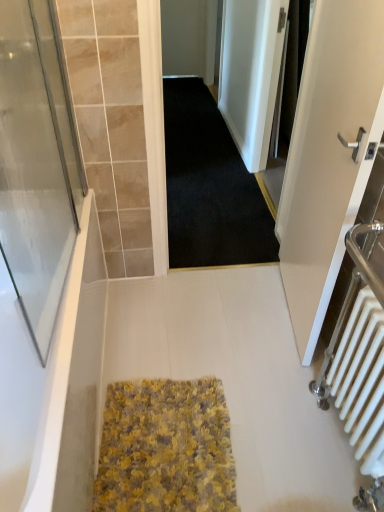
What is the approximate width of white metallic radiator at right?

It is 9.98 inches.

I want to click on black fabric screen door at upper right, marked as the first screen door in a right-to-left arrangement, so click(x=287, y=101).

In order to face transparent glass screen door at left, positioned as the second screen door in top-to-bottom order, should I rotate leftwards or rightwards?

Turn left approximately 19.048 degrees to face it.

Measure the distance between point (2, 205) and camera.

The depth of point (2, 205) is 6.33 feet.

Find the location of a particular element. Image resolution: width=384 pixels, height=512 pixels. black carpet at center is located at coordinates (210, 186).

From a real-world perspective, is white matte door at right below black carpet at center?

No, from a real-world perspective, white matte door at right is not below black carpet at center.

Considering the positions of objects white matte door at right and black carpet at center in the image provided, who is more to the right, white matte door at right or black carpet at center?

From the viewer's perspective, white matte door at right appears more on the right side.

Consider the image. Are white matte door at right and black carpet at center beside each other?

No, white matte door at right is not beside black carpet at center.

Considering the sizes of objects white matte door at right and black fabric screen door at upper right, the second screen door positioned from the bottom, in the image provided, who is bigger, white matte door at right or black fabric screen door at upper right, the second screen door positioned from the bottom,?

white matte door at right.

Is white matte door at right facing towards black fabric screen door at upper right, which ranks as the 2th screen door in front-to-back order?

No.

Is white matte door at right far from black fabric screen door at upper right, the first screen door in the back-to-front sequence?

Yes.

Between white matte door at right and black fabric screen door at upper right, the first screen door in the back-to-front sequence, which one has less height?

black fabric screen door at upper right, the first screen door in the back-to-front sequence.

Which is behind, point (219, 468) or point (45, 463)?

Positioned behind is point (219, 468).

Does yellow textured rug at center have a lesser width compared to white glossy bathtub at lower left?

Yes.

Is yellow textured rug at center in front of white glossy bathtub at lower left?

No, yellow textured rug at center is behind white glossy bathtub at lower left.

Is yellow textured rug at center oriented towards white glossy bathtub at lower left?

No, yellow textured rug at center is not oriented towards white glossy bathtub at lower left.

Is white glossy bathtub at lower left inside the boundaries of transparent glass screen door at left, the second screen door positioned from the back, or outside?

white glossy bathtub at lower left is spatially situated outside transparent glass screen door at left, the second screen door positioned from the back.

Which object is closer to the camera taking this photo, white glossy bathtub at lower left or transparent glass screen door at left, the second screen door positioned from the back?

transparent glass screen door at left, the second screen door positioned from the back, is closer to the camera.

Considering the relative positions of white glossy bathtub at lower left and transparent glass screen door at left, placed as the first screen door when sorted from left to right, in the image provided, is white glossy bathtub at lower left to the right of transparent glass screen door at left, placed as the first screen door when sorted from left to right, from the viewer's perspective?

In fact, white glossy bathtub at lower left is to the left of transparent glass screen door at left, placed as the first screen door when sorted from left to right.

From the image's perspective, which is above, white glossy bathtub at lower left or transparent glass screen door at left, positioned as the second screen door in top-to-bottom order?

transparent glass screen door at left, positioned as the second screen door in top-to-bottom order, appears higher in the image.

How many degrees apart are the facing directions of white metallic radiator at right and white matte door at right?

4.61 degrees separate the facing orientations of white metallic radiator at right and white matte door at right.

Between white metallic radiator at right and white matte door at right, which one is positioned behind?

white matte door at right is behind.

Between white metallic radiator at right and white matte door at right, which one has larger size?

Bigger between the two is white matte door at right.

This screenshot has width=384, height=512. Find the location of `bathtub to the left of black carpet at center`. bathtub to the left of black carpet at center is located at coordinates (53, 387).

Which is behind, point (25, 437) or point (188, 84)?

Positioned behind is point (188, 84).

Is white glossy bathtub at lower left not near black carpet at center?

That's right, there is a large distance between white glossy bathtub at lower left and black carpet at center.

From the image's perspective, is white glossy bathtub at lower left positioned above or below black carpet at center?

white glossy bathtub at lower left is situated lower than black carpet at center in the image.

Between black fabric screen door at upper right, marked as the first screen door in a right-to-left arrangement, and white matte door at right, which one is positioned behind?

black fabric screen door at upper right, marked as the first screen door in a right-to-left arrangement, is more distant.

Is black fabric screen door at upper right, the first screen door in the back-to-front sequence, positioned with its back to white matte door at right?

black fabric screen door at upper right, the first screen door in the back-to-front sequence, does not have its back to white matte door at right.

What are the coordinates of `screen door lying behind the white matte door at right` in the screenshot? It's located at (287, 101).

Where is `door in front of the black carpet at center`? The height and width of the screenshot is (512, 384). door in front of the black carpet at center is located at coordinates (329, 156).

Where is `the 2nd screen door positioned above the white matte door at right (from the image's perspective)`? This screenshot has width=384, height=512. the 2nd screen door positioned above the white matte door at right (from the image's perspective) is located at coordinates (287, 101).

Which object lies further to the anchor point yellow textured rug at center, transparent glass screen door at left, the second screen door when ordered from right to left, or white glossy bathtub at lower left?

The object further to yellow textured rug at center is transparent glass screen door at left, the second screen door when ordered from right to left.

Looking at the image, which one is located closer to transparent glass screen door at left, the 1th screen door positioned from the bottom, white matte door at right or white glossy bathtub at lower left?

Based on the image, white glossy bathtub at lower left appears to be nearer to transparent glass screen door at left, the 1th screen door positioned from the bottom.

Looking at the image, which one is located further to transparent glass screen door at left, the second screen door when ordered from right to left, white glossy bathtub at lower left or white matte door at right?

white matte door at right.

Which object lies further to the anchor point white glossy bathtub at lower left, black carpet at center or white matte door at right?

black carpet at center is further to white glossy bathtub at lower left.

When comparing their distances from white matte door at right, does yellow textured rug at center or white metallic radiator at right seem closer?

The object closer to white matte door at right is white metallic radiator at right.

Estimate the real-world distances between objects in this image. Which object is further from black fabric screen door at upper right, the second screen door positioned from the bottom, white glossy bathtub at lower left or transparent glass screen door at left, the 1th screen door positioned from the bottom?

The object further to black fabric screen door at upper right, the second screen door positioned from the bottom, is white glossy bathtub at lower left.

Which object lies nearer to the anchor point white matte door at right, black carpet at center or yellow textured rug at center?

yellow textured rug at center is positioned closer to the anchor white matte door at right.

Considering their positions, is black carpet at center positioned further to white glossy bathtub at lower left than white metallic radiator at right?

Based on the image, black carpet at center appears to be further to white glossy bathtub at lower left.

The image size is (384, 512). In order to click on bathtub between white metallic radiator at right and black carpet at center in the front-back direction in this screenshot , I will do `click(53, 387)`.

Image resolution: width=384 pixels, height=512 pixels. What are the coordinates of `door located between transparent glass screen door at left, positioned as the second screen door in top-to-bottom order, and white metallic radiator at right in the left-right direction` in the screenshot? It's located at (329, 156).

What are the coordinates of `radiator between black carpet at center and yellow textured rug at center in the vertical direction` in the screenshot? It's located at (361, 380).

What are the coordinates of `bathtub positioned between white metallic radiator at right and black fabric screen door at upper right, the 1th screen door from the top, from near to far` in the screenshot? It's located at (53, 387).